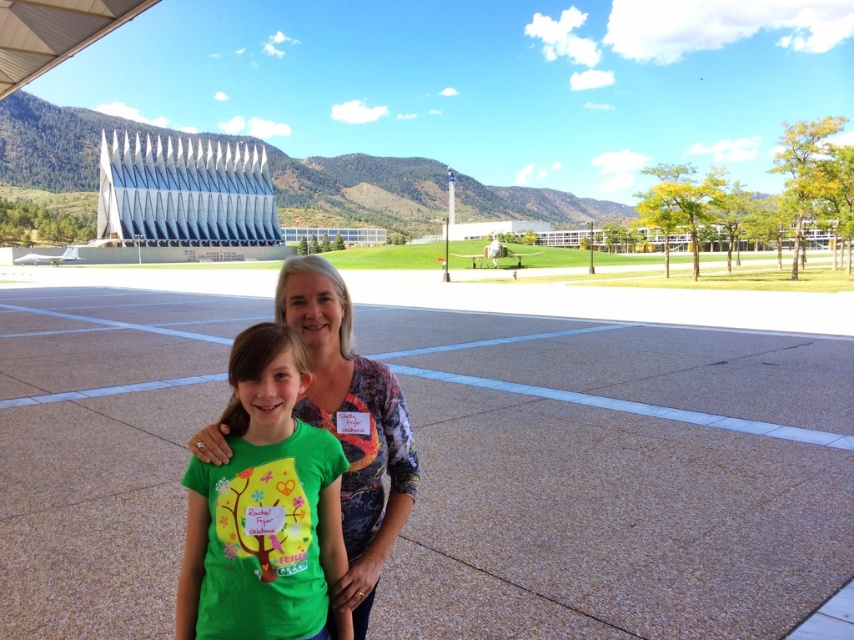
You are standing at the back of the image and want to take a photo of the green concrete football field at center and the green matte shirt at center. Which object should you focus on first to ensure both are in the frame?

The green concrete football field at center is located above the green matte shirt at center, so you should focus on the green matte shirt at center first to ensure both are in the frame.